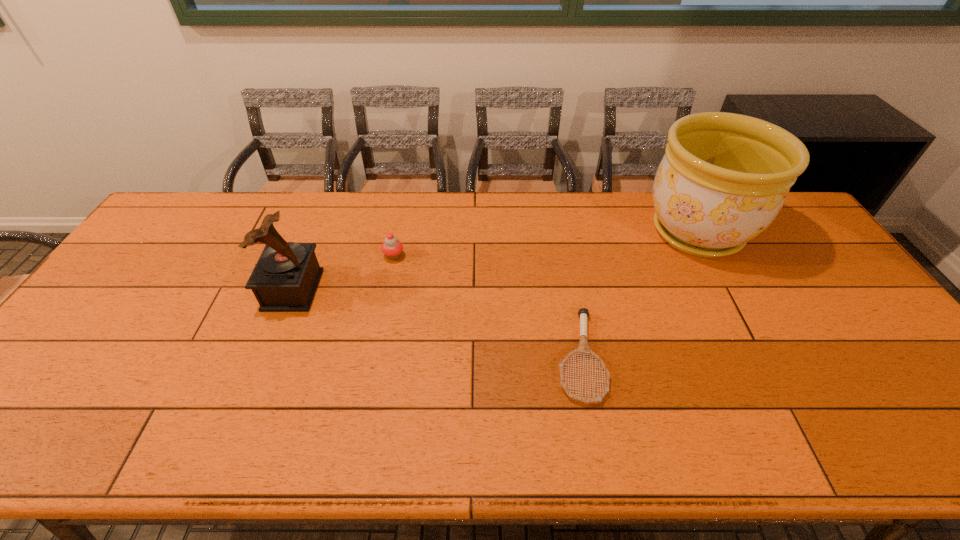
Find the location of `free space located on the right of the third object from right to left`. free space located on the right of the third object from right to left is located at coordinates (420, 256).

Find the location of `vacant area situated on the left of the second object from right to left`. vacant area situated on the left of the second object from right to left is located at coordinates (443, 356).

The image size is (960, 540). What are the coordinates of `object present at the far edge` in the screenshot? It's located at (724, 178).

Identify the location of free space at the far edge of the desktop. pyautogui.click(x=223, y=220).

The width and height of the screenshot is (960, 540). What are the coordinates of `vacant region at the near edge of the desktop` in the screenshot? It's located at (238, 429).

The image size is (960, 540). In the image, there is a desktop. What are the coordinates of `free region at the left edge` in the screenshot? It's located at (148, 275).

Find the location of a particular element. This screenshot has width=960, height=540. vacant space at the right edge of the desktop is located at coordinates pyautogui.click(x=838, y=334).

Identify the location of vacant space at the near left corner. This screenshot has height=540, width=960. (21, 455).

Identify the location of free space between the phonograph_record and the tennis racket. (436, 323).

Where is `unoccupied position between the shortest object and the third tallest object`? unoccupied position between the shortest object and the third tallest object is located at coordinates (487, 306).